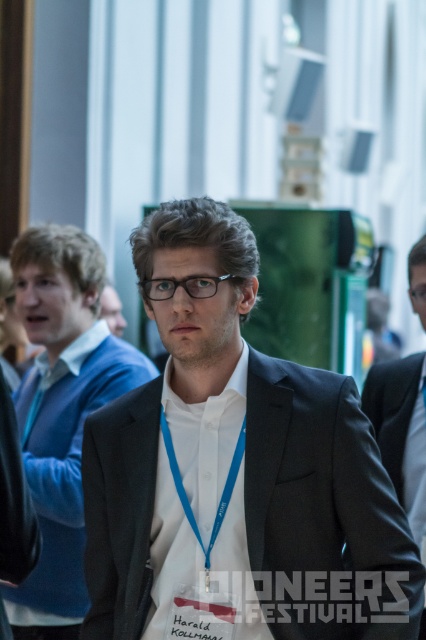
You are a photographer at the Pioneers Festival and need to capture a group photo of the black matte suit at center and dark gray suit at center. Which one is on the right side when facing the camera?

The black matte suit at center is positioned on the right side of dark gray suit at center, so when facing the camera, the black matte suit at center will be on the right side.

You are at the Pioneers Festival and need to locate the black matte suit at center. According to the coordinates provided, where exactly is it positioned in the image?

The black matte suit at center is located at the coordinates point (244, 513) in the image.